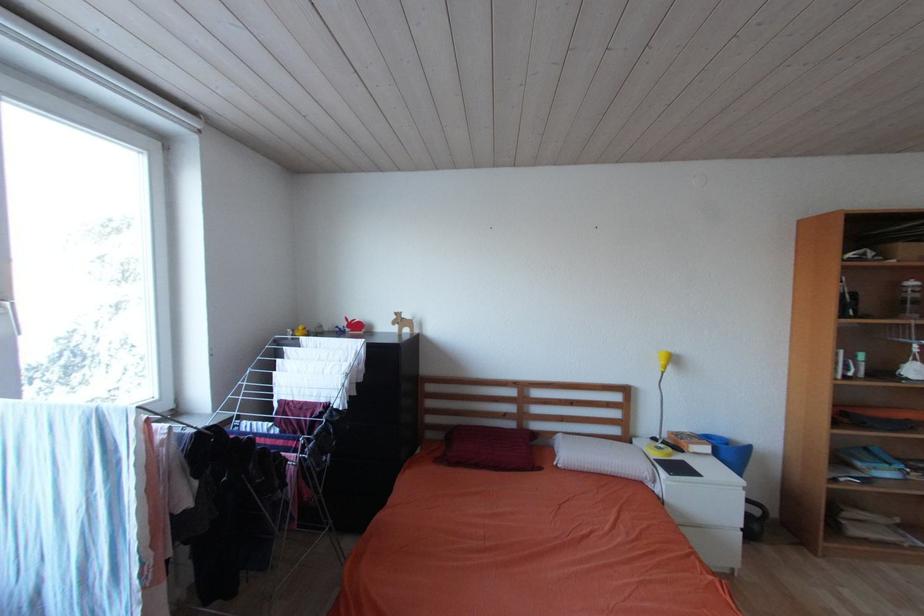
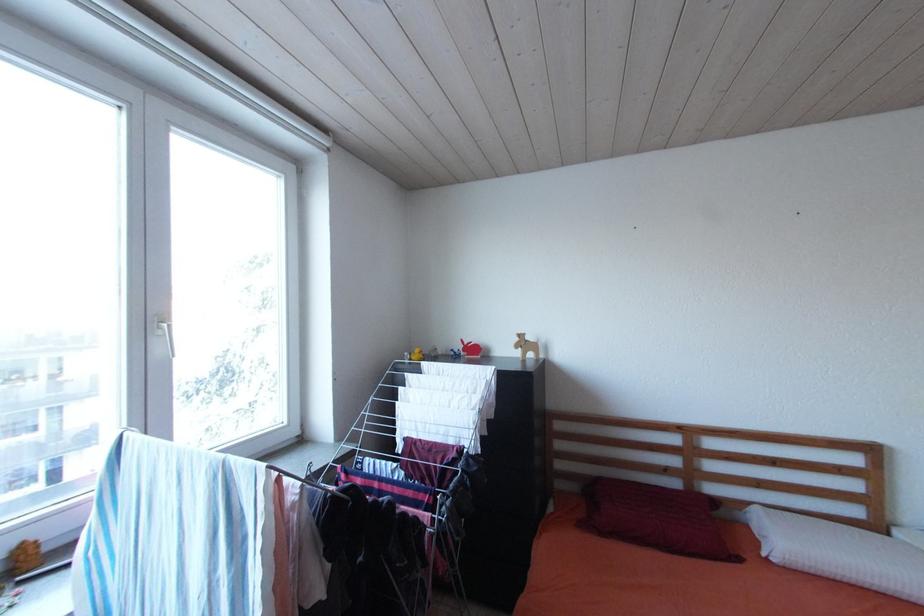
In a continuous first-person perspective shot, in which direction is the camera moving?

The movement direction of the cameraman is left, forward.